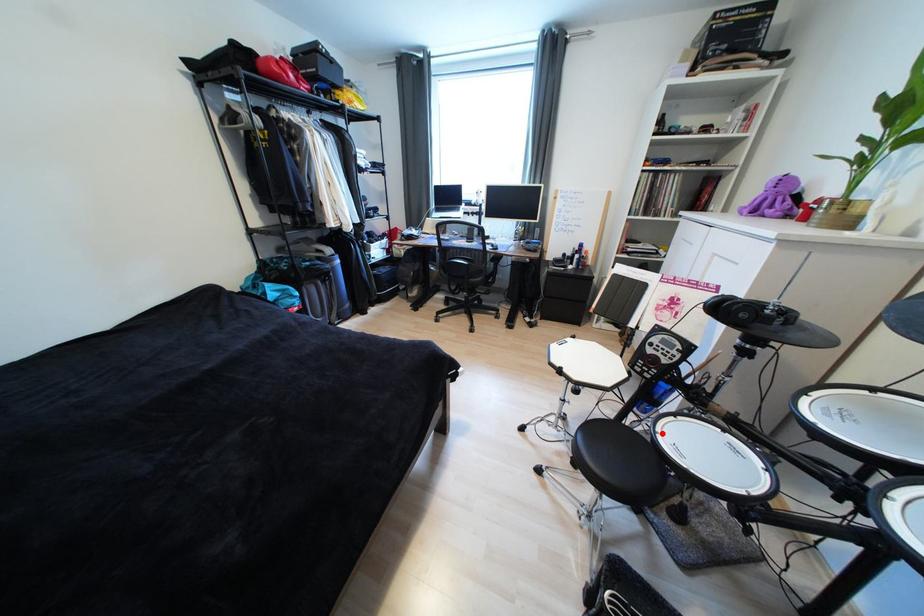
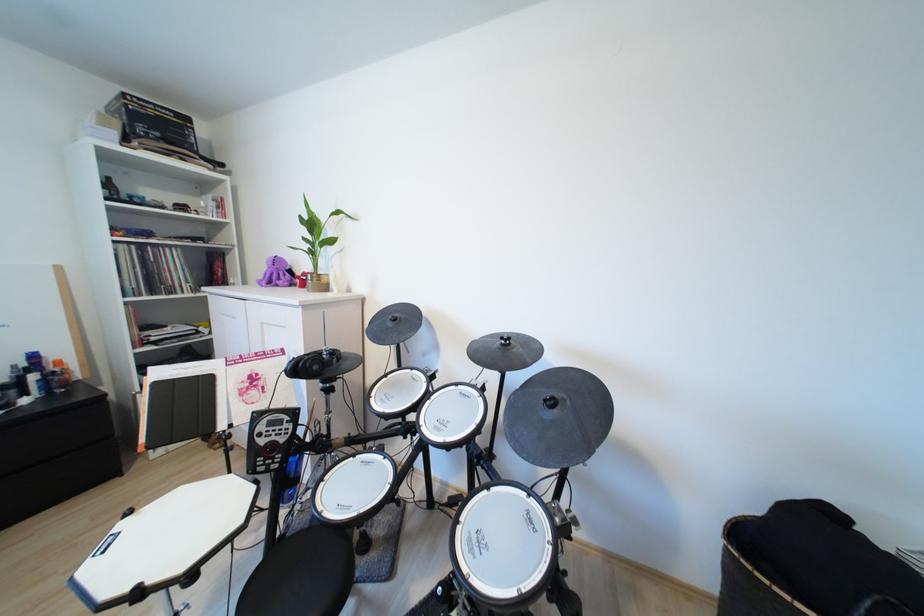
Question: I am providing you with two images of the same scene from different viewpoints. Given a red point in image1, look at the same physical point in image2. Is it:

Choices:
 (A) Closer to the viewpoint
 (B) Farther from the viewpoint

Answer: (B)